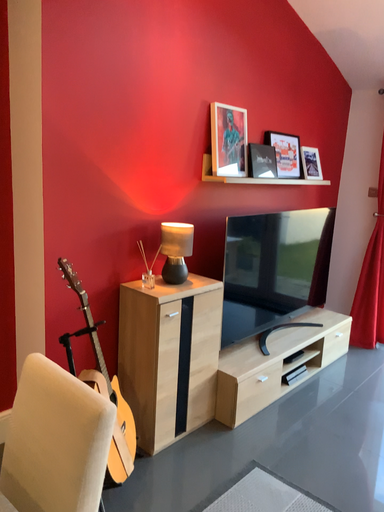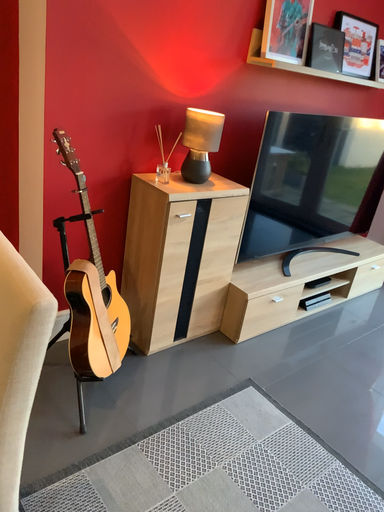
Question: Which way did the camera rotate in the video?

Choices:
 (A) rotated downward
 (B) rotated upward

Answer: (A)